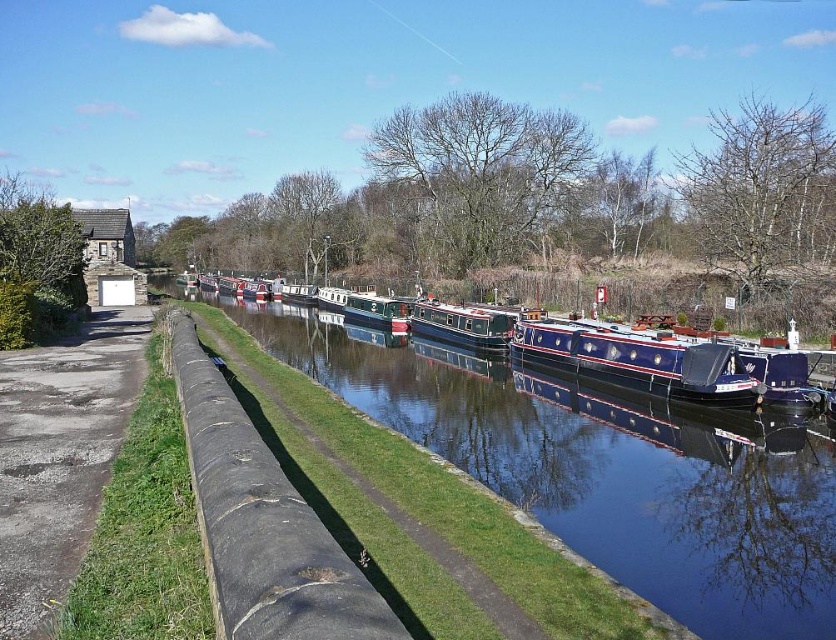
You are a tourist standing on the paved path near the canal. You want to take a photo of the green polished wooden boat at center without any obstructions. Is the porous concrete path at left blocking your view of the boat?

The porous concrete path at left is closer to the viewer than the green polished wooden boat at center, so it may block your view of the boat. Move to a position where the path is not between you and the boat to get an unobstructed photo.

You are standing at the point with coordinates point (390, 307) and want to walk towards the point with coordinates point (103, 449). Which direction should you face to walk directly towards it?

You should face towards the lower right direction to walk directly towards point (103, 449) from point (390, 307).

You are a delivery person carrying a 1.5 meter wide package and need to navigate through the canal area. The porous concrete path at left and the green polished wooden boat at center are both potential routes. Based on their widths, which path can accommodate your package?

The porous concrete path at left is wider than the green polished wooden boat at center. Since the package is 1.5 meters wide, the porous concrete path at left can accommodate it, while the green polished wooden boat at center may be too narrow.